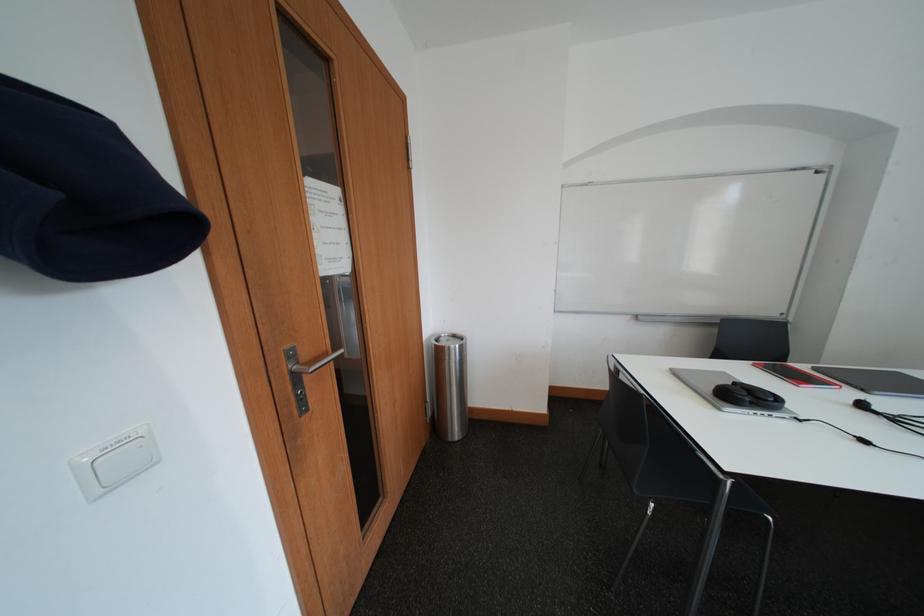
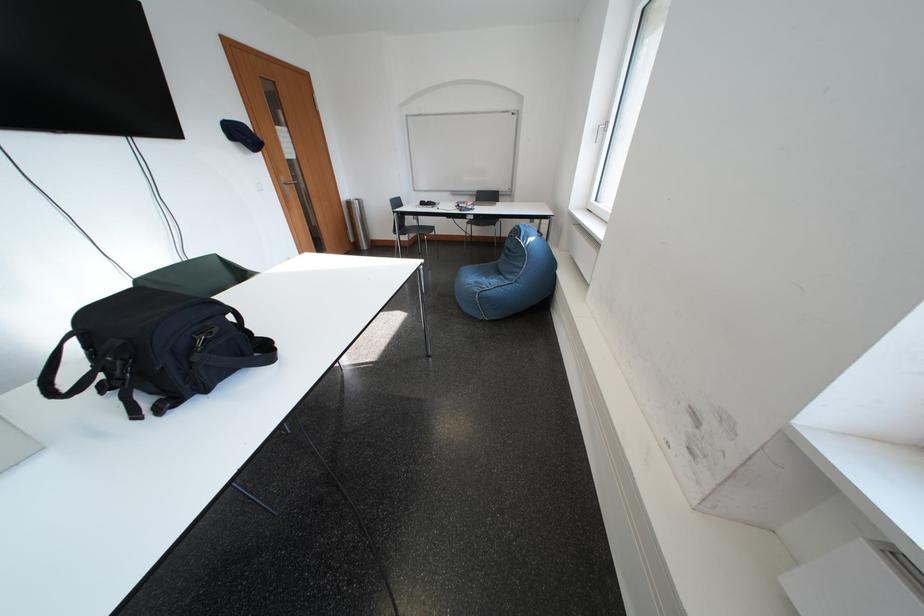
Which direction would the cameraman need to move to produce the second image?

The cameraman walked toward right, backward.